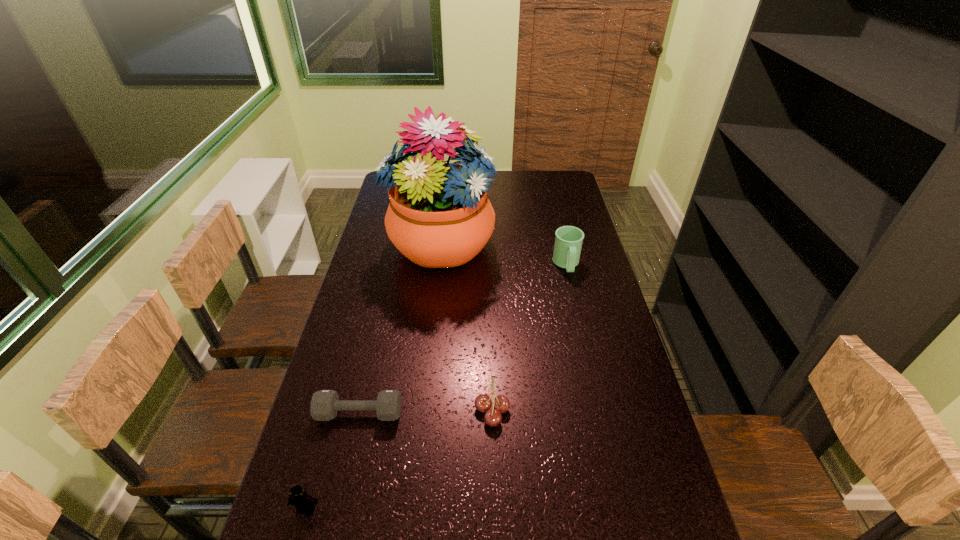
You are a GUI agent. You are given a task and a screenshot of the screen. Output one action in this format:
    pyautogui.click(x=<x>, y=<y>)
    Task: Click on the empty space between the dumbbell and the cherry
    This screenshot has width=960, height=540.
    Given the screenshot: What is the action you would take?
    pyautogui.click(x=425, y=412)

In order to click on vacant space that is in between the fourth shortest object and the shortest object in this screenshot , I will do `click(463, 339)`.

This screenshot has height=540, width=960. I want to click on unoccupied area between the nearest object and the fourth shortest object, so click(x=437, y=387).

The height and width of the screenshot is (540, 960). What are the coordinates of `vacant area between the tallest object and the nearest object` in the screenshot? It's located at (373, 376).

You are a GUI agent. You are given a task and a screenshot of the screen. Output one action in this format:
    pyautogui.click(x=<x>, y=<y>)
    Task: Click on the free point between the tallest object and the Lego
    Image resolution: width=960 pixels, height=540 pixels.
    Given the screenshot: What is the action you would take?
    pyautogui.click(x=373, y=376)

Where is `free space between the cherry and the dumbbell`? free space between the cherry and the dumbbell is located at coordinates (425, 412).

Where is `free spot between the dumbbell and the cherry`? This screenshot has width=960, height=540. free spot between the dumbbell and the cherry is located at coordinates (425, 412).

Locate an element on the screen. The width and height of the screenshot is (960, 540). vacant point located between the flower arrangement and the dumbbell is located at coordinates (400, 328).

Choose which object is the third nearest neighbor to the Lego. Please provide its 2D coordinates. Your answer should be formatted as a tuple, i.e. [(x, y)], where the tuple contains the x and y coordinates of a point satisfying the conditions above.

[(439, 215)]

You are a GUI agent. You are given a task and a screenshot of the screen. Output one action in this format:
    pyautogui.click(x=<x>, y=<y>)
    Task: Click on the object identified as the fourth closest to the nearest object
    This screenshot has width=960, height=540.
    Given the screenshot: What is the action you would take?
    pyautogui.click(x=568, y=241)